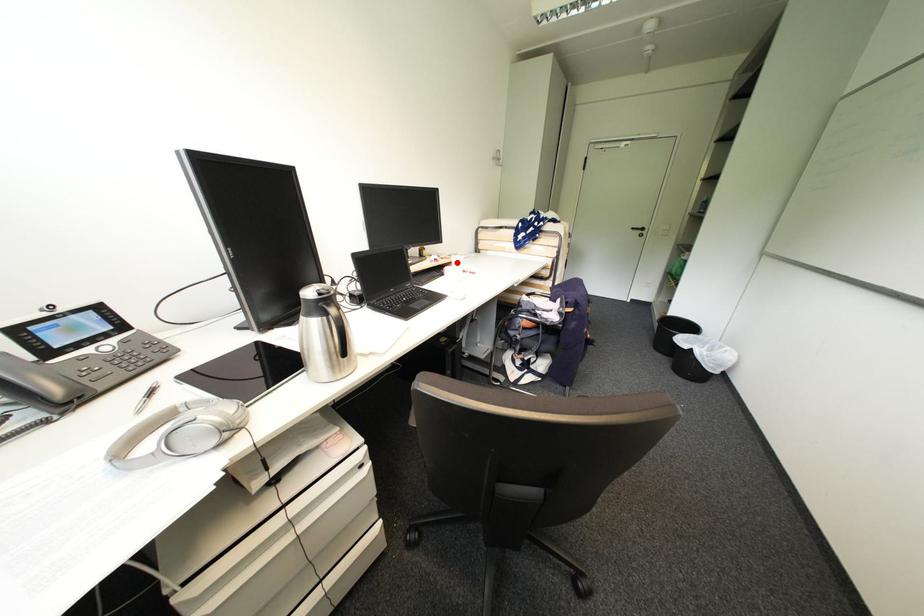
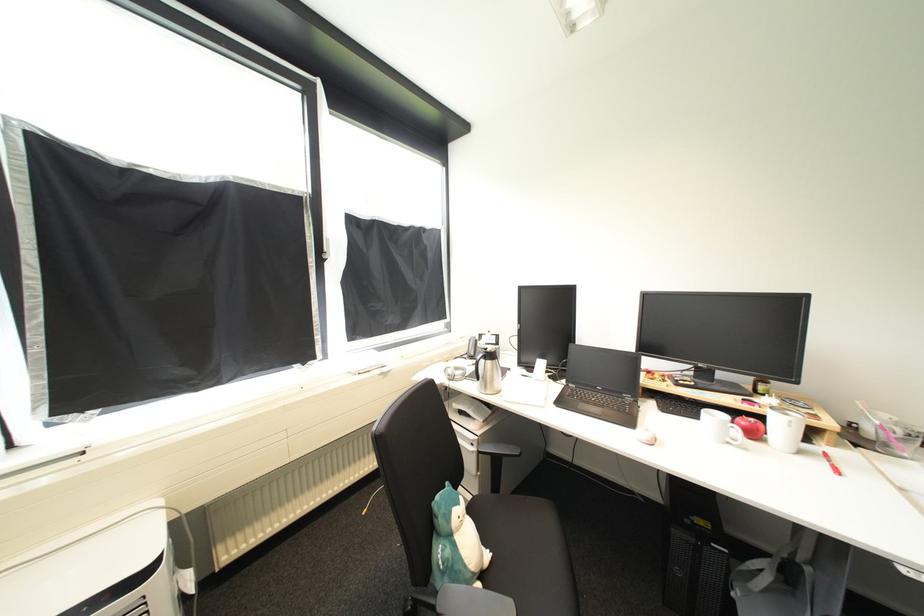
Where in the second image is the point corresponding to the highlighted location from the first image?

(784, 419)